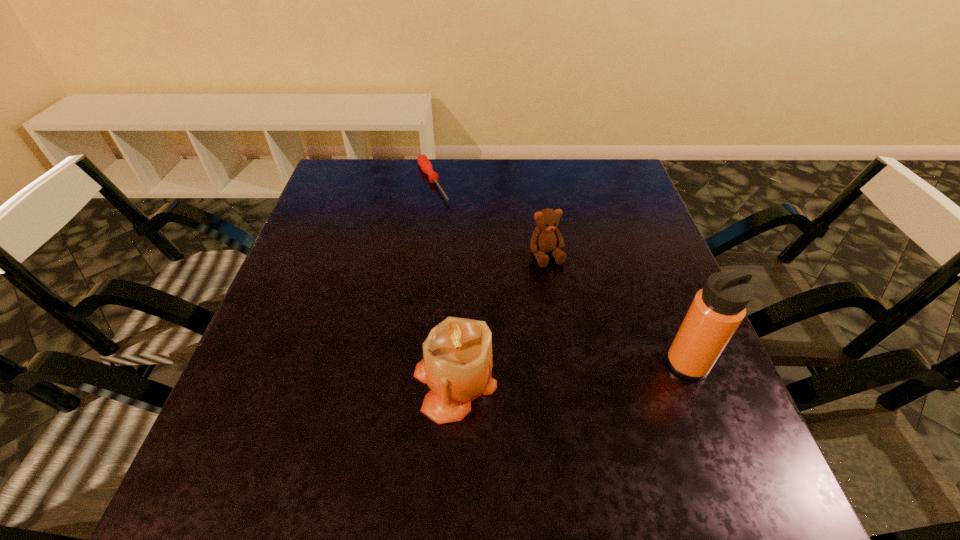
Where is `the second tallest object`? the second tallest object is located at coordinates (457, 364).

This screenshot has height=540, width=960. I want to click on the tallest object, so click(x=717, y=310).

The height and width of the screenshot is (540, 960). In order to click on the rightmost object in this screenshot , I will do `click(717, 310)`.

This screenshot has width=960, height=540. I want to click on the shortest object, so click(x=424, y=163).

Where is `screwdriver`? The height and width of the screenshot is (540, 960). screwdriver is located at coordinates (424, 163).

The image size is (960, 540). I want to click on the second farthest object, so click(546, 238).

At what (x,y) coordinates should I click in order to perform the action: click on the second object from right to left. Please return your answer as a coordinate pair (x, y). The width and height of the screenshot is (960, 540). Looking at the image, I should click on (546, 238).

I want to click on free region located 0.210m on the left of the second tallest object, so click(x=300, y=381).

You are a GUI agent. You are given a task and a screenshot of the screen. Output one action in this format:
    pyautogui.click(x=<x>, y=<y>)
    Task: Click on the vacant space located 0.180m on the left of the tallest object
    
    Given the screenshot: What is the action you would take?
    pyautogui.click(x=572, y=364)

The image size is (960, 540). Identify the location of free space located 0.390m at the tip of the shortest object. (496, 299).